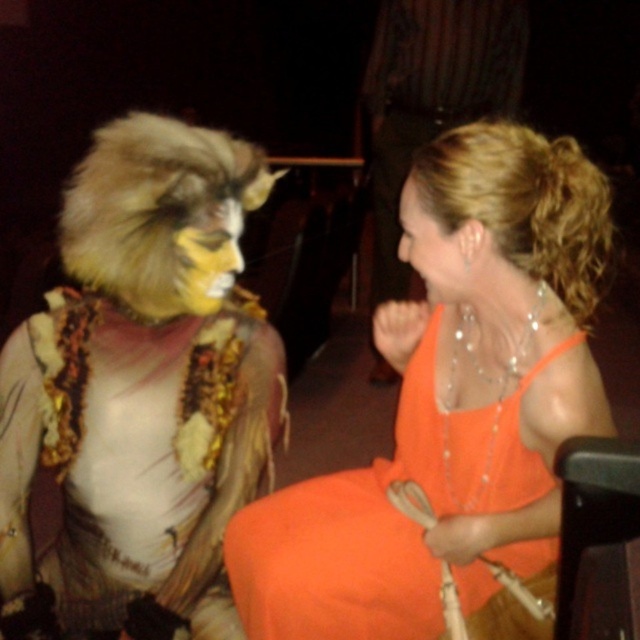
You are a photographer trying to capture a closeup shot of the orange satin dress at center and the yellow fur face at center. The camera you are using has a minimum focusing distance of 15 inches. Can you take the photo without moving either subject?

The orange satin dress at center is 15.38 inches from the yellow fur face at center. Since the minimum focusing distance is 15 inches, the camera can focus on both subjects as the distance between them is slightly more than the required minimum. Therefore, you can take the photo without moving either subject.

You are standing at the center of the image and want to move towards the furry costume at left. Which direction should you go?

The furry costume at left is located at point 0.606 on the x axis and 0.223 on the y axis. Since you are at the center, which is at point 0.5 on both axes, you should move slightly to the right along the x axis and upwards along the y axis to reach the furry costume at left.

From the picture: You are an interior designer trying to arrange two orange dresses in a display case. The display case has two shelves, one above the other. You have the orange satin dress at center and the smooth orange dress at center. According to the scene, which dress should you place on the lower shelf?

The orange satin dress at center is located below the smooth orange dress at center in the scene, so to replicate this arrangement, place the orange satin dress at center on the lower shelf and the smooth orange dress at center on the upper shelf.